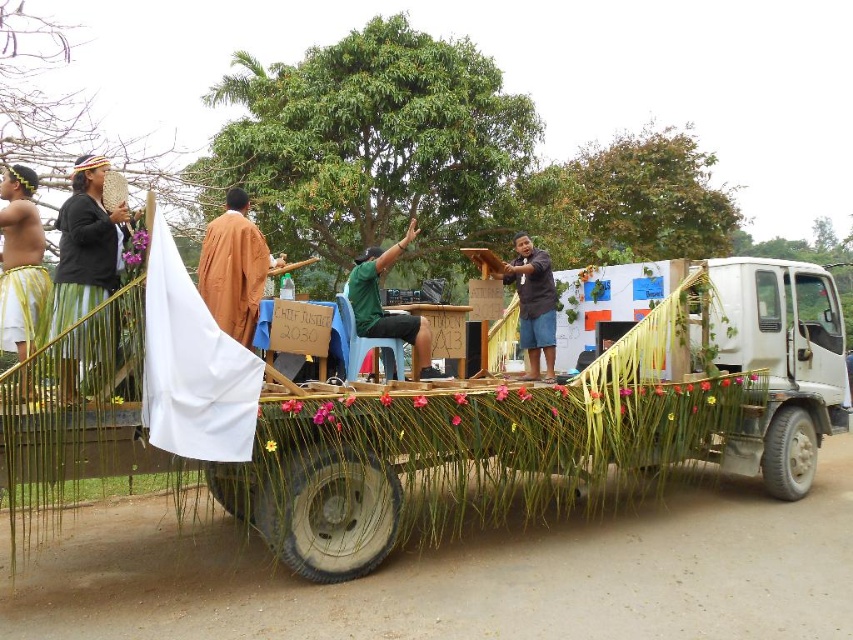
Question: Observing the image, what is the correct spatial positioning of matte black woven hat at upper left in reference to yellow grass skirt at left?

Choices:
 (A) below
 (B) above

Answer: (A)

Question: Estimate the real-world distances between objects in this image. Which object is farther from the matte black woven hat at upper left?

Choices:
 (A) brown cloth at center
 (B) brown fabric at center
 (C) green matte shirt at center
 (D) yellow grass skirt at left

Answer: (B)

Question: Which point is farther to the camera?

Choices:
 (A) (35, 312)
 (B) (103, 285)
 (C) (381, 268)

Answer: (C)

Question: Estimate the real-world distances between objects in this image. Which object is farther from the brown cloth at center?

Choices:
 (A) green matte shirt at center
 (B) yellow grass skirt at left
 (C) brown fabric at center
 (D) matte black woven hat at upper left

Answer: (C)

Question: Can you confirm if yellow grass skirt at left is thinner than brown fabric at center?

Choices:
 (A) yes
 (B) no

Answer: (A)

Question: Is yellow grass skirt at left thinner than brown fabric at center?

Choices:
 (A) yes
 (B) no

Answer: (A)